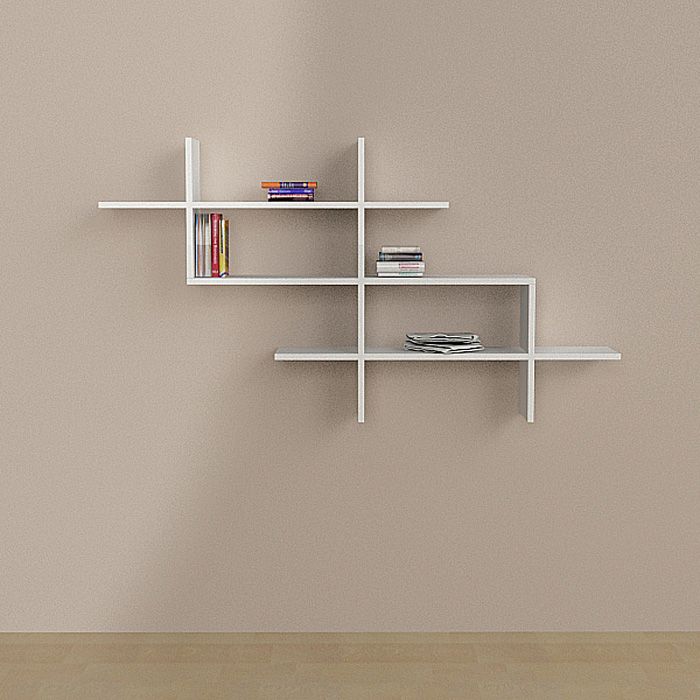
Where is `shelving sections`? This screenshot has width=700, height=700. shelving sections is located at coordinates (150, 202), (316, 204), (406, 204), (284, 281), (412, 280), (335, 356), (447, 355), (598, 357).